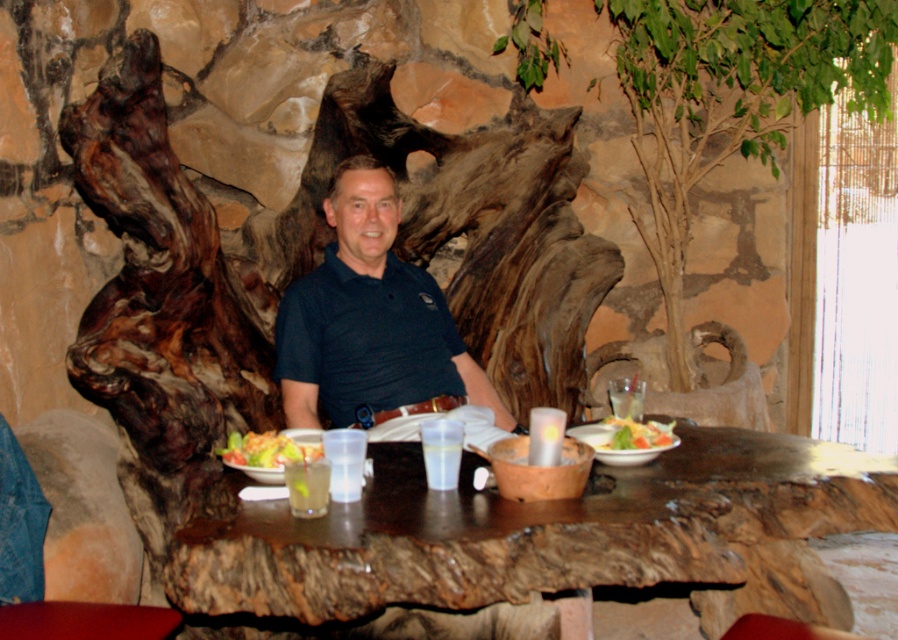
Question: Among these points, which one is farthest from the camera?

Choices:
 (A) (414, 348)
 (B) (624, 65)
 (C) (265, 456)
 (D) (304, 595)

Answer: (B)

Question: Among these points, which one is farthest from the camera?

Choices:
 (A) (339, 502)
 (B) (195, 237)
 (C) (287, 342)
 (D) (349, 282)

Answer: (D)

Question: Is dark blue polo shirt at center smaller than fresh salad at center?

Choices:
 (A) no
 (B) yes

Answer: (A)

Question: Is brown rough wood tree trunk at center in front of dark blue cotton polo shirt at center?

Choices:
 (A) yes
 (B) no

Answer: (A)

Question: In this image, where is dark blue cotton polo shirt at center located relative to shiny plastic salad bowl at center?

Choices:
 (A) above
 (B) below

Answer: (A)

Question: Which of the following is the farthest from the observer?

Choices:
 (A) brown rough wood tree trunk at center
 (B) shiny plastic salad bowl at center
 (C) dark blue polo shirt at center

Answer: (C)